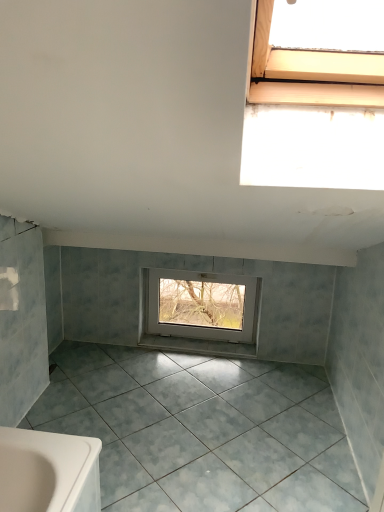
Question: Is point (167, 349) closer or farther from the camera than point (187, 282)?

Choices:
 (A) closer
 (B) farther

Answer: (A)

Question: From their relative heights in the image, would you say white glossy tile at center is taller or shorter than white plastic window at center?

Choices:
 (A) tall
 (B) short

Answer: (B)

Question: Which object is positioned farthest from the white plastic window at center?

Choices:
 (A) white glossy tile at center
 (B) gray matte tile at center

Answer: (B)

Question: Estimate the real-world distances between objects in this image. Which object is farther from the white plastic window at center?

Choices:
 (A) white glossy tile at center
 (B) gray matte tile at center

Answer: (B)